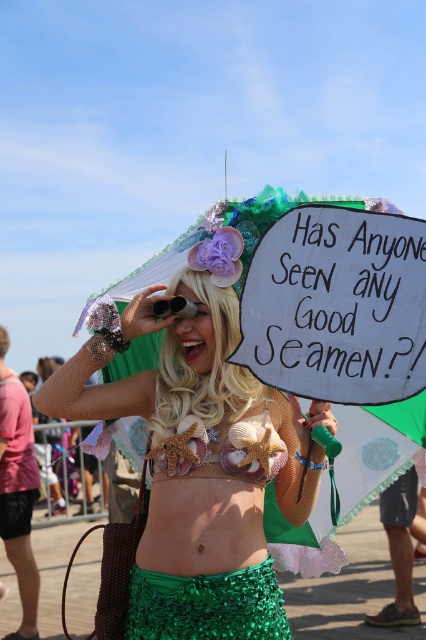
What are the coordinates of the green sequined skirt at lower center?

The green sequined skirt at lower center is located at coordinates point (x=198, y=467).

You are a photographer at the event and want to take a clear photo of both the blonde hair wig at center and the seashell bikini top at center. Which object should you focus on first to ensure both are in focus?

You should focus on the blonde hair wig at center first since it is closer to you than the seashell bikini top at center, ensuring both will be in focus when using depth of field techniques.

You are a photographer at the event and want to take a photo of the mermaid costume. You notice the blonde hair wig at center and the seashell bikini top at center. Which object is covering the other one?

The blonde hair wig at center is positioned over the seashell bikini top at center.